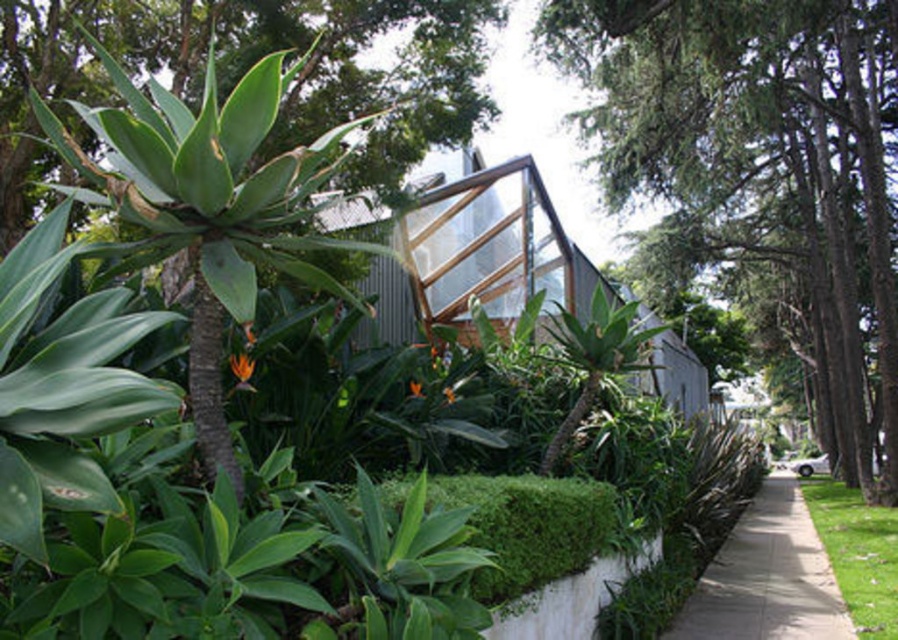
Does green leafy plant at center appear over gray concrete sidewalk at lower right?

Yes, green leafy plant at center is above gray concrete sidewalk at lower right.

Is green leafy plant at center shorter than gray concrete sidewalk at lower right?

Yes, green leafy plant at center is shorter than gray concrete sidewalk at lower right.

Which is behind, point (209, 400) or point (810, 636)?

The point (810, 636) is behind.

Locate an element on the screen. The width and height of the screenshot is (898, 640). green leafy plant at center is located at coordinates (208, 205).

Does green leafy tree at center have a smaller size compared to gray concrete sidewalk at lower right?

No.

Does point (852, 92) come farther from viewer compared to point (758, 592)?

Yes, it is.

The height and width of the screenshot is (640, 898). I want to click on green leafy tree at center, so click(x=762, y=172).

Does point (799, 490) come closer to viewer compared to point (852, 620)?

No, (799, 490) is behind (852, 620).

Locate an element on the screen. gray concrete sidewalk at lower right is located at coordinates pos(767,577).